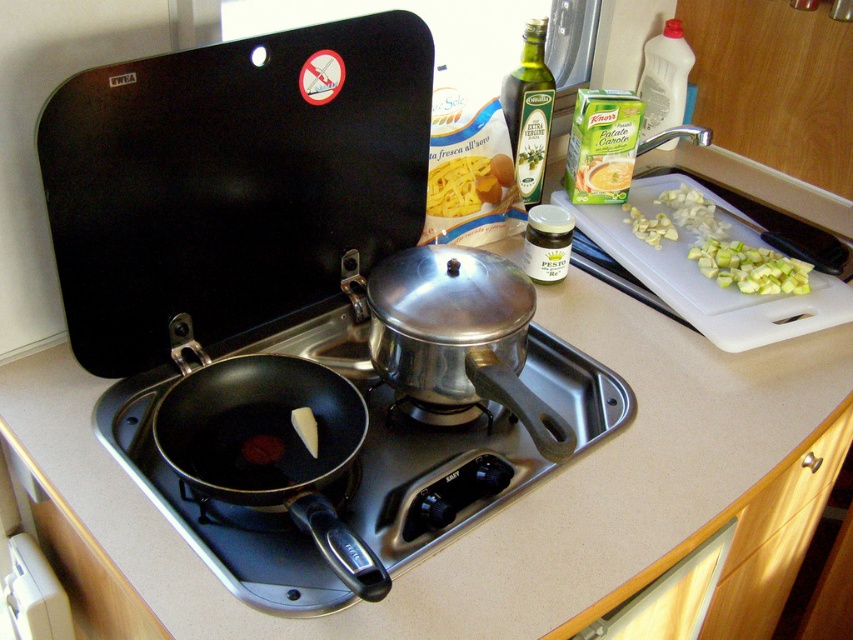
Question: In this image, where is black matte pan at lower left located relative to white plastic cutting board at upper right?

Choices:
 (A) below
 (B) above

Answer: (A)

Question: Among these points, which one is farthest from the camera?

Choices:
 (A) (209, 378)
 (B) (354, 529)

Answer: (A)

Question: Which point is closer to the camera taking this photo?

Choices:
 (A) click(x=602, y=422)
 (B) click(x=175, y=337)
 (C) click(x=821, y=308)

Answer: (B)

Question: Does black matte pan at lower left lie behind matte black frying pan at lower left?

Choices:
 (A) no
 (B) yes

Answer: (B)

Question: Does black matte pan at lower left have a greater width compared to matte black frying pan at lower left?

Choices:
 (A) yes
 (B) no

Answer: (A)

Question: Among these points, which one is farthest from the camera?

Choices:
 (A) (306, 516)
 (B) (148, 451)
 (C) (813, 282)

Answer: (C)